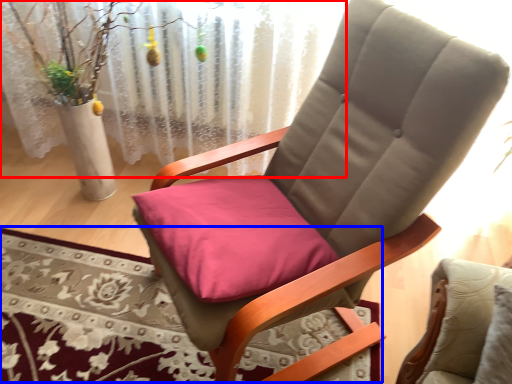
Question: Which object is closer to the camera taking this photo, curtain (highlighted by a red box) or mat (highlighted by a blue box)?

Choices:
 (A) curtain
 (B) mat

Answer: (B)